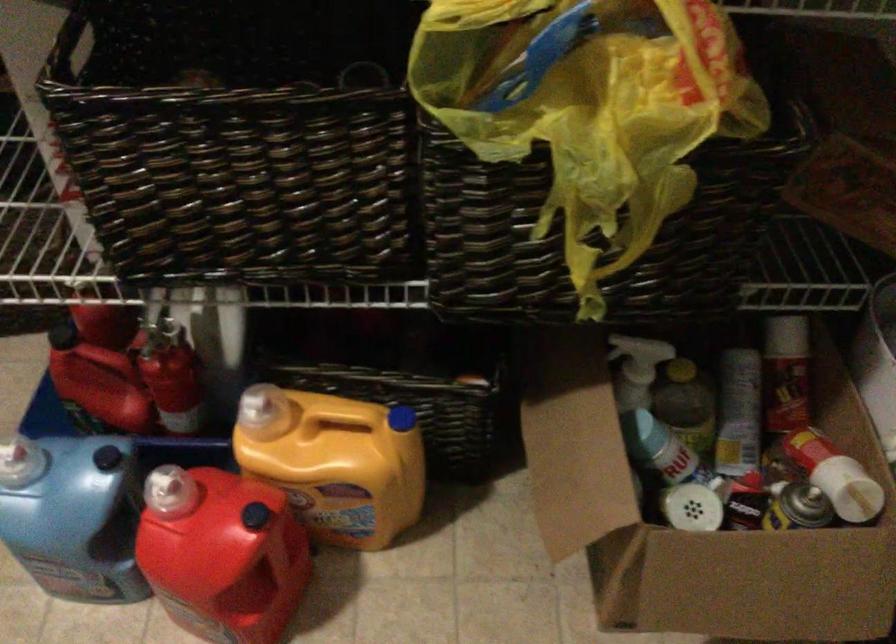
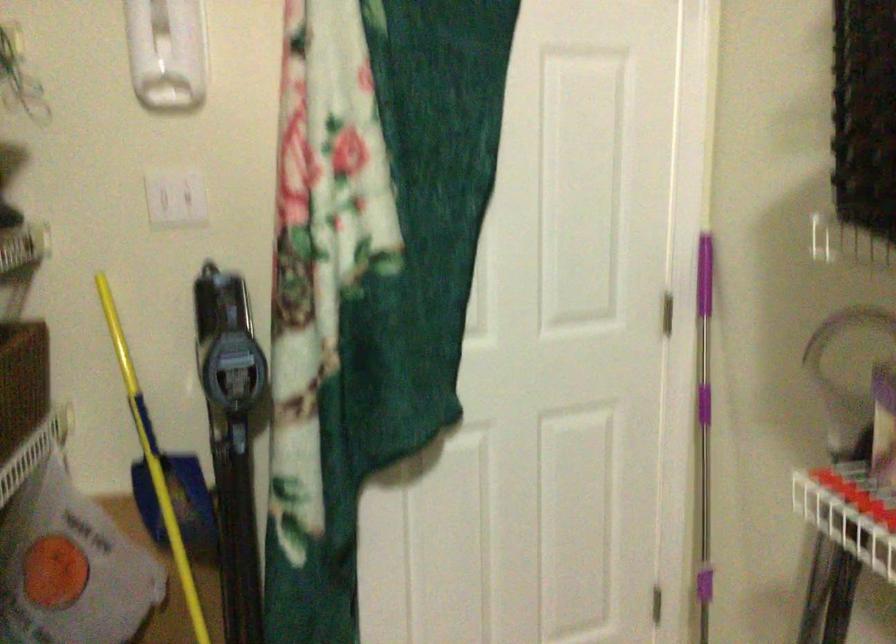
The images are taken continuously from a first-person perspective. In which direction is your viewpoint rotating?

The camera's rotation is toward right-down.